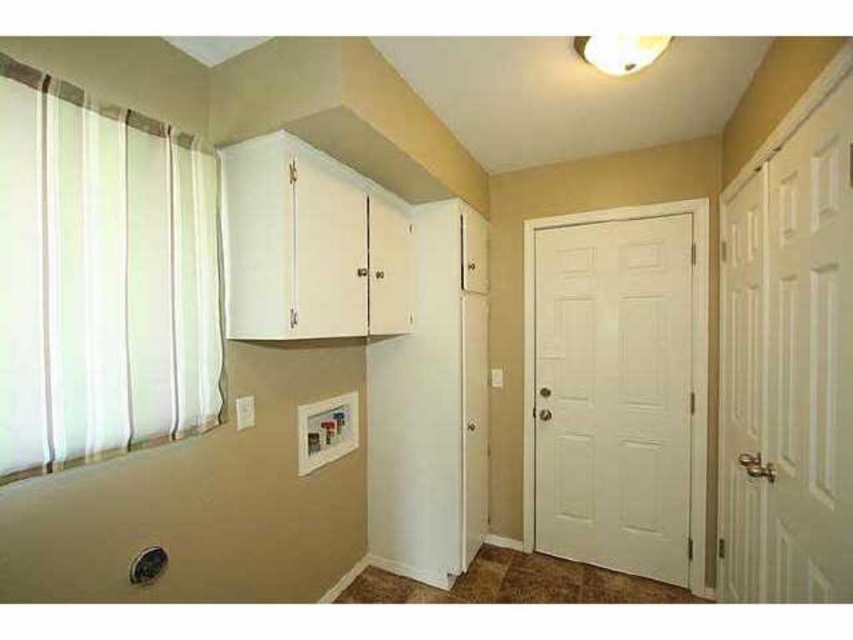
Question: Is white sheer curtain at left above white matte door at right?

Choices:
 (A) no
 (B) yes

Answer: (B)

Question: Which object appears farthest from the camera in this image?

Choices:
 (A) white matte door at right
 (B) white sheer curtain at left

Answer: (A)

Question: Is white sheer curtain at left behind white matte door at right?

Choices:
 (A) yes
 (B) no

Answer: (B)

Question: Can you confirm if white sheer curtain at left is positioned to the left of white matte door at right?

Choices:
 (A) no
 (B) yes

Answer: (B)